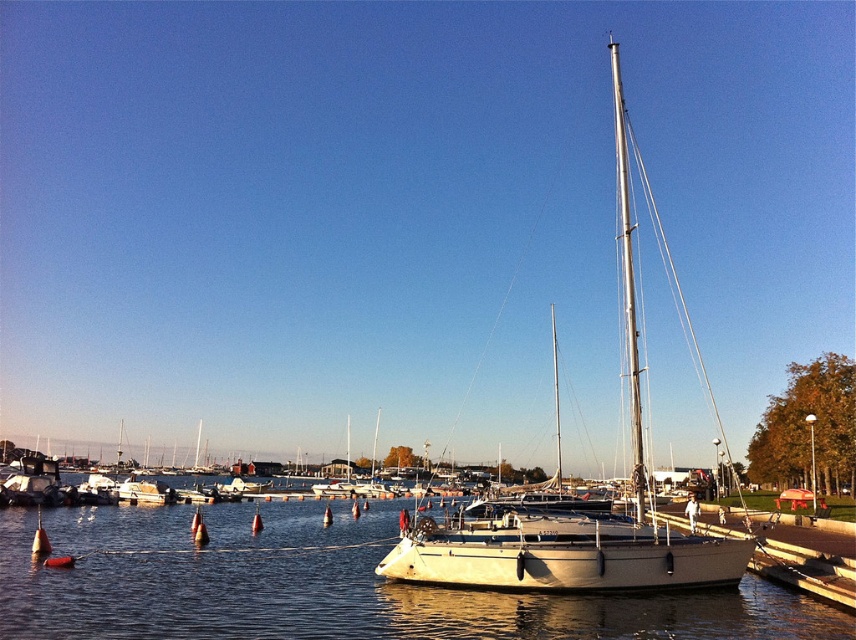
Question: From the image, what is the correct spatial relationship of white matte water at center in relation to white matte sailboat at center?

Choices:
 (A) above
 (B) below

Answer: (B)

Question: Where is white matte water at center located in relation to white matte sailboat at center in the image?

Choices:
 (A) below
 (B) above

Answer: (A)

Question: Which point appears closest to the camera in this image?

Choices:
 (A) (116, 580)
 (B) (477, 538)

Answer: (A)

Question: Among these points, which one is nearest to the camera?

Choices:
 (A) (528, 534)
 (B) (193, 586)

Answer: (A)

Question: Is white matte water at center below white matte sailboat at center?

Choices:
 (A) no
 (B) yes

Answer: (B)

Question: Which object is closer to the camera taking this photo?

Choices:
 (A) white matte sailboat at center
 (B) white matte water at center

Answer: (B)